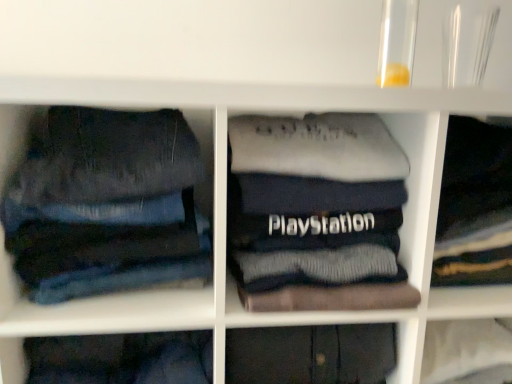
Image resolution: width=512 pixels, height=384 pixels. Describe the element at coordinates (474, 206) in the screenshot. I see `dark gray sweater at center, the second clothing from the left` at that location.

Identify the location of denim jeans at left. The image size is (512, 384). (106, 204).

Looking at this image, which is correct: dark blue cotton sweatshirt at center, which ranks as the first clothing in left-to-right order, is inside dark gray sweater at center, the second clothing from the left, or outside of it?

The correct answer is: outside.

Considering the relative sizes of dark blue cotton sweatshirt at center, which ranks as the first clothing in left-to-right order, and dark gray sweater at center, the second clothing from the left, in the image provided, is dark blue cotton sweatshirt at center, which ranks as the first clothing in left-to-right order, smaller than dark gray sweater at center, the second clothing from the left,?

No, dark blue cotton sweatshirt at center, which ranks as the first clothing in left-to-right order, is not smaller than dark gray sweater at center, the second clothing from the left.

Can you confirm if dark blue cotton sweatshirt at center, the second clothing from the right, is positioned to the left of dark gray sweater at center, acting as the 1th clothing starting from the right?

Yes.

How far apart are dark blue cotton sweatshirt at center, the second clothing from the right, and dark gray sweater at center, acting as the 1th clothing starting from the right?

dark blue cotton sweatshirt at center, the second clothing from the right, is 8.92 inches away from dark gray sweater at center, acting as the 1th clothing starting from the right.

Consider the image. Can you confirm if denim jeans at left is bigger than dark gray sweater at center, acting as the 1th clothing starting from the right?

Yes, denim jeans at left is bigger than dark gray sweater at center, acting as the 1th clothing starting from the right.

Does denim jeans at left turn towards dark gray sweater at center, acting as the 1th clothing starting from the right?

No.

Does point (179, 164) appear closer or farther from the camera than point (472, 149)?

Point (179, 164).

Who is more distant, dark blue cotton sweatshirt at center, the second clothing from the right, or denim jeans at left?

Positioned behind is dark blue cotton sweatshirt at center, the second clothing from the right.

Is dark blue cotton sweatshirt at center, the second clothing from the right, placed right next to denim jeans at left?

No, dark blue cotton sweatshirt at center, the second clothing from the right, is not with denim jeans at left.

From the image's perspective, which one is positioned lower, dark blue cotton sweatshirt at center, the second clothing from the right, or denim jeans at left?

dark blue cotton sweatshirt at center, the second clothing from the right, is shown below in the image.

The width and height of the screenshot is (512, 384). In order to click on trousers on the left of dark blue cotton sweatshirt at center, the second clothing from the right in this screenshot , I will do `click(106, 204)`.

Considering the sizes of dark gray sweater at center, the second clothing from the left, and dark blue cotton sweatshirt at center, which ranks as the first clothing in left-to-right order, in the image, is dark gray sweater at center, the second clothing from the left, bigger or smaller than dark blue cotton sweatshirt at center, which ranks as the first clothing in left-to-right order,?

Considering their sizes, dark gray sweater at center, the second clothing from the left, takes up less space than dark blue cotton sweatshirt at center, which ranks as the first clothing in left-to-right order.

Can you tell me how much dark gray sweater at center, acting as the 1th clothing starting from the right, and dark blue cotton sweatshirt at center, the second clothing from the right, differ in facing direction?

0.000187 degrees.

Does point (472, 227) come behind point (313, 277)?

Yes, point (472, 227) is farther from viewer.

Is dark gray sweater at center, the second clothing from the left, positioned far away from dark blue cotton sweatshirt at center, the second clothing from the right?

No, there isn't a large distance between dark gray sweater at center, the second clothing from the left, and dark blue cotton sweatshirt at center, the second clothing from the right.

Can you confirm if denim jeans at left is bigger than dark blue cotton sweatshirt at center, which ranks as the first clothing in left-to-right order?

Incorrect, denim jeans at left is not larger than dark blue cotton sweatshirt at center, which ranks as the first clothing in left-to-right order.

Does denim jeans at left have a greater width compared to dark blue cotton sweatshirt at center, the second clothing from the right?

Incorrect, the width of denim jeans at left does not surpass that of dark blue cotton sweatshirt at center, the second clothing from the right.

Is denim jeans at left in contact with dark blue cotton sweatshirt at center, which ranks as the first clothing in left-to-right order?

No, denim jeans at left is not beside dark blue cotton sweatshirt at center, which ranks as the first clothing in left-to-right order.

From a real-world perspective, is denim jeans at left above or below dark blue cotton sweatshirt at center, the second clothing from the right?

From a real-world perspective, denim jeans at left is physically below dark blue cotton sweatshirt at center, the second clothing from the right.

Considering the relative sizes of dark gray sweater at center, acting as the 1th clothing starting from the right, and denim jeans at left in the image provided, is dark gray sweater at center, acting as the 1th clothing starting from the right, thinner than denim jeans at left?

Indeed, dark gray sweater at center, acting as the 1th clothing starting from the right, has a lesser width compared to denim jeans at left.

Looking at this image, between dark gray sweater at center, acting as the 1th clothing starting from the right, and denim jeans at left, which one appears on the left side from the viewer's perspective?

Positioned to the left is denim jeans at left.

Which of these two, dark gray sweater at center, acting as the 1th clothing starting from the right, or denim jeans at left, is smaller?

dark gray sweater at center, acting as the 1th clothing starting from the right, is smaller.

Does dark gray sweater at center, acting as the 1th clothing starting from the right, have a greater height compared to denim jeans at left?

In fact, dark gray sweater at center, acting as the 1th clothing starting from the right, may be shorter than denim jeans at left.

Image resolution: width=512 pixels, height=384 pixels. What are the coordinates of `clothing on the right of dark blue cotton sweatshirt at center, which ranks as the first clothing in left-to-right order` in the screenshot? It's located at (474, 206).

From the denim jeans at left, count 2nd clothings backward and point to it. Please provide its 2D coordinates.

[(474, 206)]

Which object lies further to the anchor point denim jeans at left, dark gray sweater at center, acting as the 1th clothing starting from the right, or dark blue cotton sweatshirt at center, the second clothing from the right?

Among the two, dark gray sweater at center, acting as the 1th clothing starting from the right, is located further to denim jeans at left.

Considering their positions, is dark blue cotton sweatshirt at center, which ranks as the first clothing in left-to-right order, positioned closer to denim jeans at left than dark gray sweater at center, acting as the 1th clothing starting from the right?

Based on the image, dark blue cotton sweatshirt at center, which ranks as the first clothing in left-to-right order, appears to be nearer to denim jeans at left.

Which object lies further to the anchor point dark gray sweater at center, acting as the 1th clothing starting from the right, dark blue cotton sweatshirt at center, the second clothing from the right, or denim jeans at left?

denim jeans at left is positioned further to the anchor dark gray sweater at center, acting as the 1th clothing starting from the right.

Based on their spatial positions, is dark gray sweater at center, the second clothing from the left, or denim jeans at left closer to dark blue cotton sweatshirt at center, which ranks as the first clothing in left-to-right order?

denim jeans at left is closer to dark blue cotton sweatshirt at center, which ranks as the first clothing in left-to-right order.

When comparing their distances from dark blue cotton sweatshirt at center, which ranks as the first clothing in left-to-right order, does denim jeans at left or dark gray sweater at center, the second clothing from the left, seem further?

dark gray sweater at center, the second clothing from the left.

When comparing their distances from dark gray sweater at center, acting as the 1th clothing starting from the right, does denim jeans at left or dark blue cotton sweatshirt at center, which ranks as the first clothing in left-to-right order, seem further?

Based on the image, denim jeans at left appears to be further to dark gray sweater at center, acting as the 1th clothing starting from the right.

Locate an element on the screen. The width and height of the screenshot is (512, 384). clothing between denim jeans at left and dark gray sweater at center, the second clothing from the left is located at coordinates (316, 213).